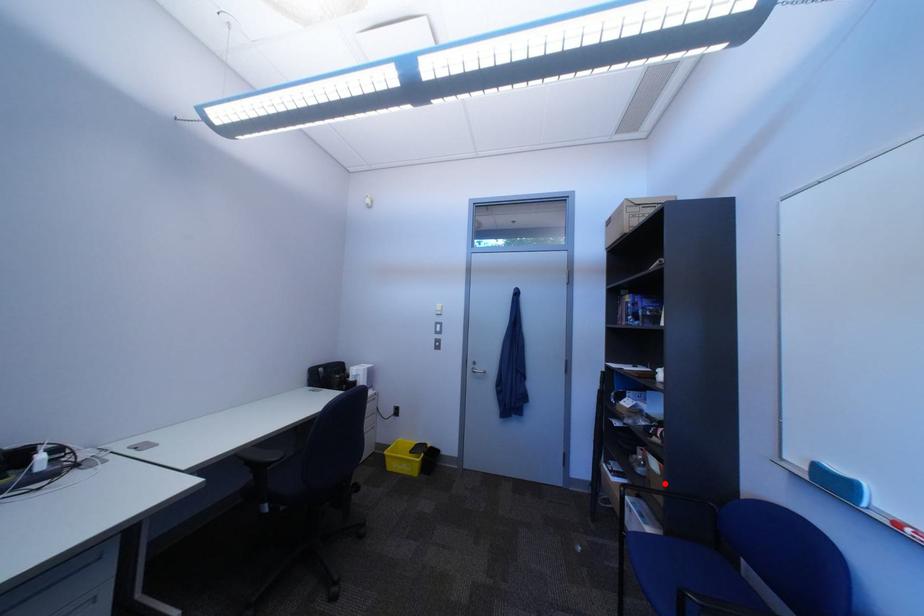
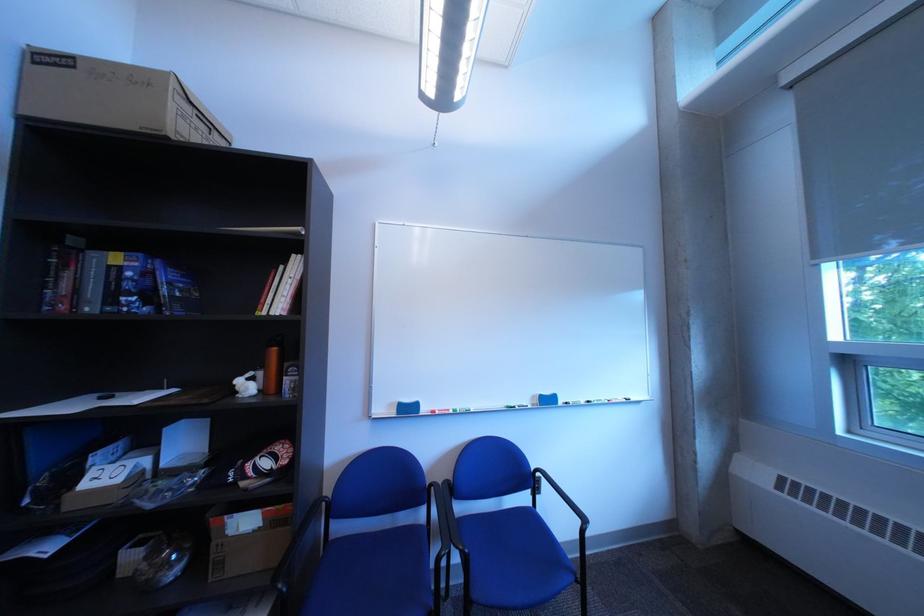
Question: I am providing you with two images of the same scene from different viewpoints. Image1 has a red point marked. In image2, the corresponding 3D location appears at what relative position? Reply with the corresponding letter.

Choices:
 (A) Closer
 (B) Farther

Answer: (A)